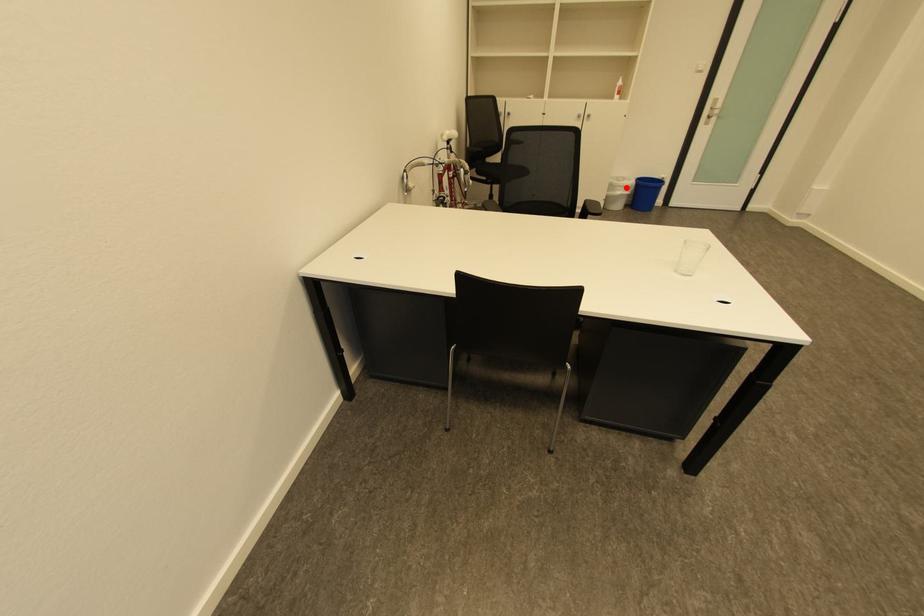
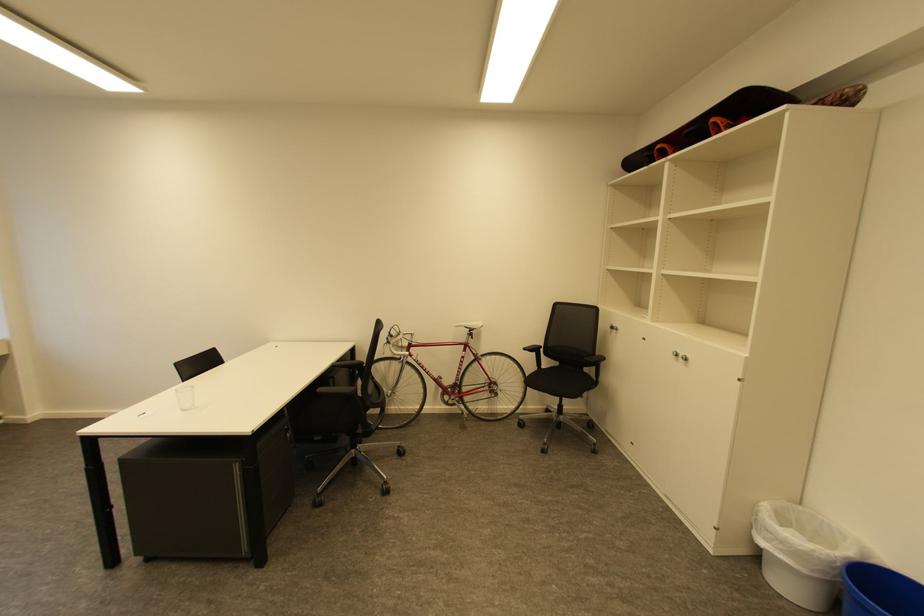
In the second image, find the point that corresponds to the highlighted location in the first image.

(775, 533)